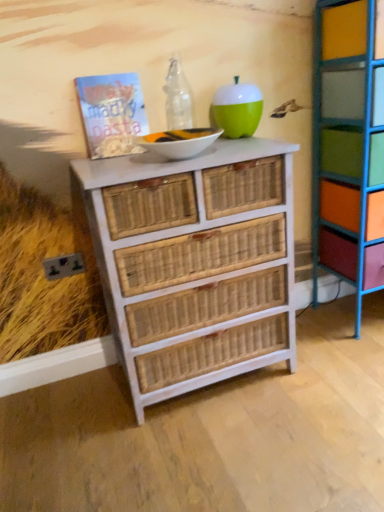
Question: Considering the positions of matte paper book at upper left and multicolored painted wood shelf at right in the image, is matte paper book at upper left wider or thinner than multicolored painted wood shelf at right?

Choices:
 (A) thin
 (B) wide

Answer: (A)

Question: Is matte paper book at upper left taller or shorter than multicolored painted wood shelf at right?

Choices:
 (A) tall
 (B) short

Answer: (B)

Question: Based on their relative distances, which object is farther from the white wicker chest of drawers at center?

Choices:
 (A) green matte apple at upper center
 (B) multicolored painted wood shelf at right
 (C) matte paper book at upper left

Answer: (B)

Question: Which of these objects is positioned farthest from the white wicker chest of drawers at center?

Choices:
 (A) matte paper book at upper left
 (B) green matte apple at upper center
 (C) multicolored painted wood shelf at right

Answer: (C)